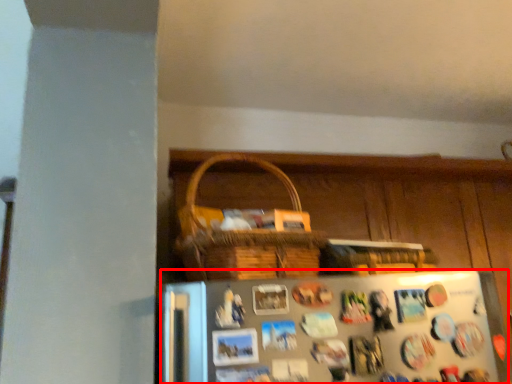
Question: Considering the relative positions of refrigerator (annotated by the red box) and dresser in the image provided, where is refrigerator (annotated by the red box) located with respect to the staircase?

Choices:
 (A) left
 (B) right

Answer: (A)